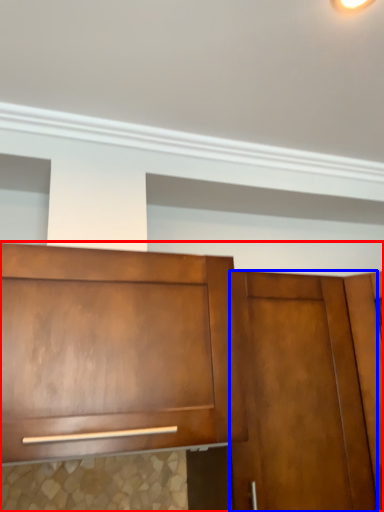
Question: Which object appears farthest to the camera in this image, cabinetry (highlighted by a red box) or door (highlighted by a blue box)?

Choices:
 (A) cabinetry
 (B) door

Answer: (B)